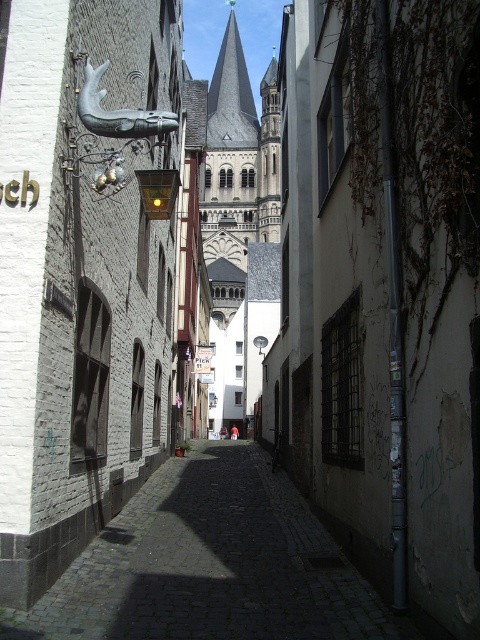
You are a delivery person trying to park your 1.2 meter wide cart in this alley. The alley has a smooth concrete wall at center and a cobblestone street at center. Can your cart fit between them?

The smooth concrete wall at center is larger in size than cobblestone street at center, so the space between them may be too narrow for your 1.2 meter wide cart. Check the exact dimensions before attempting to park.

You are a delivery person with a cart that is 5 feet wide. You need to navigate through the narrow alleyway shown in the image. Can your cart fit between the smooth concrete wall at center and the cobblestone street at center?

The distance between the smooth concrete wall at center and the cobblestone street at center is 44.65 feet, which is significantly wider than the 5 feet width of your cart. Therefore, your cart can easily fit between them.